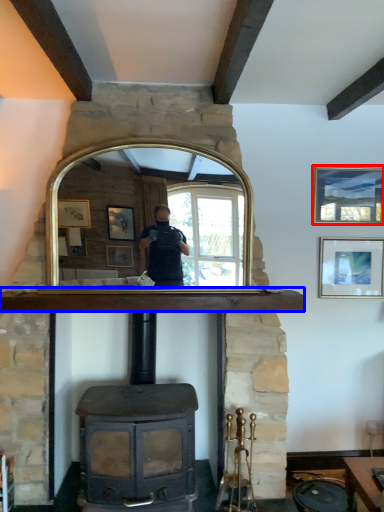
Question: Which point is further to the camera, picture frame (highlighted by a red box) or mantle (highlighted by a blue box)?

Choices:
 (A) picture frame
 (B) mantle

Answer: (A)